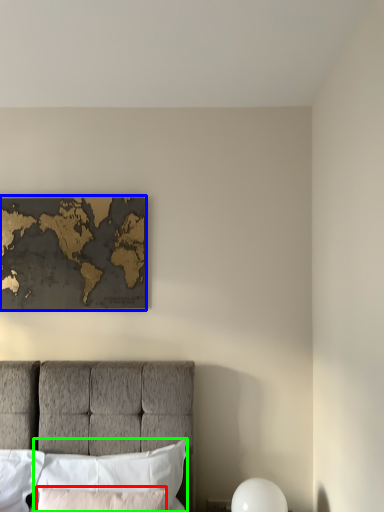
Question: Based on their relative distances, which object is farther from pillow (highlighted by a red box)? Choose from picture frame (highlighted by a blue box) and pillow (highlighted by a green box).

Choices:
 (A) picture frame
 (B) pillow

Answer: (A)